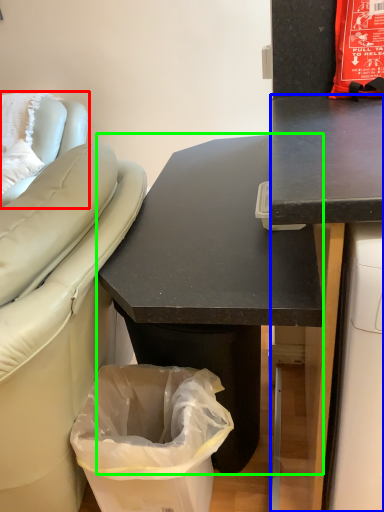
Question: Which is nearer to the furniture (highlighted by a red box)? desk (highlighted by a blue box) or desk (highlighted by a green box).

Choices:
 (A) desk
 (B) desk

Answer: (B)